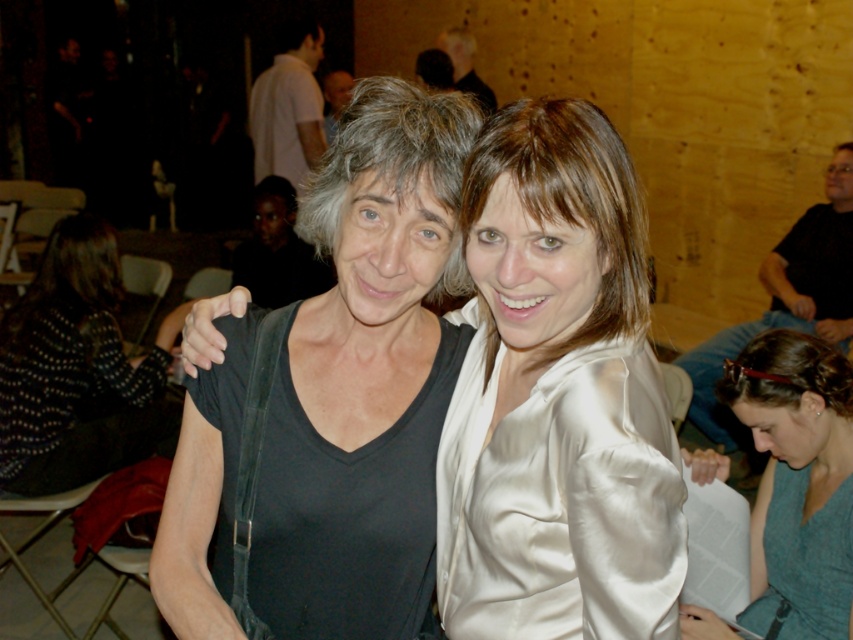
In the scene shown: Does satin white blouse at center have a smaller size compared to gray silk blouse at lower right?

Indeed, satin white blouse at center has a smaller size compared to gray silk blouse at lower right.

Is satin white blouse at center to the right of gray silk blouse at lower right from the viewer's perspective?

In fact, satin white blouse at center is to the left of gray silk blouse at lower right.

Is point (451, 637) in front of point (759, 560)?

That is True.

Locate an element on the screen. The height and width of the screenshot is (640, 853). satin white blouse at center is located at coordinates (560, 499).

Is point (468, 465) less distant than point (97, 332)?

Yes, it is.

Does black matte shirt at center have a smaller size compared to black matte shirt at left?

Yes, black matte shirt at center is smaller than black matte shirt at left.

Which is in front, point (511, 108) or point (73, 262)?

Point (511, 108)

Locate an element on the screen. black matte shirt at center is located at coordinates point(558,394).

Does black matte shirt at center appear over satin white blouse at center?

Correct, black matte shirt at center is located above satin white blouse at center.

Can you confirm if black matte shirt at center is positioned to the right of satin white blouse at center?

Incorrect, black matte shirt at center is not on the right side of satin white blouse at center.

Which is behind, point (549, 164) or point (491, 483)?

The point (491, 483) is more distant.

Find the location of `black matte shirt at center`. black matte shirt at center is located at coordinates (558, 394).